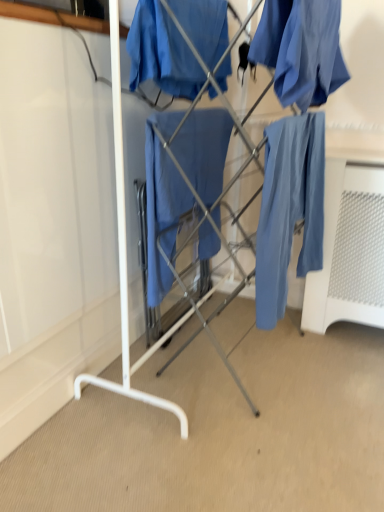
Question: Visually, is matte blue fabric at upper right, marked as the second clothing in a left-to-right arrangement, positioned to the left or to the right of matte blue pants at right?

Choices:
 (A) right
 (B) left

Answer: (B)

Question: From the image's perspective, is matte blue fabric at upper right, marked as the second clothing in a left-to-right arrangement, above or below matte blue pants at right?

Choices:
 (A) below
 (B) above

Answer: (B)

Question: Which object is the farthest from the matte blue fabric at center, the 2th clothing viewed from the right?

Choices:
 (A) matte blue fabric at center
 (B) matte blue fabric at center
 (C) matte blue pants at right
 (D) matte blue fabric at upper right, which ranks as the 1th clothing in right-to-left order

Answer: (C)

Question: Estimate the real-world distances between objects in this image. Which object is closer to the matte blue pants at right?

Choices:
 (A) matte blue fabric at center, the 2th clothing viewed from the right
 (B) matte blue fabric at center
 (C) matte blue fabric at upper right, which ranks as the 1th clothing in right-to-left order
 (D) matte blue fabric at center

Answer: (C)